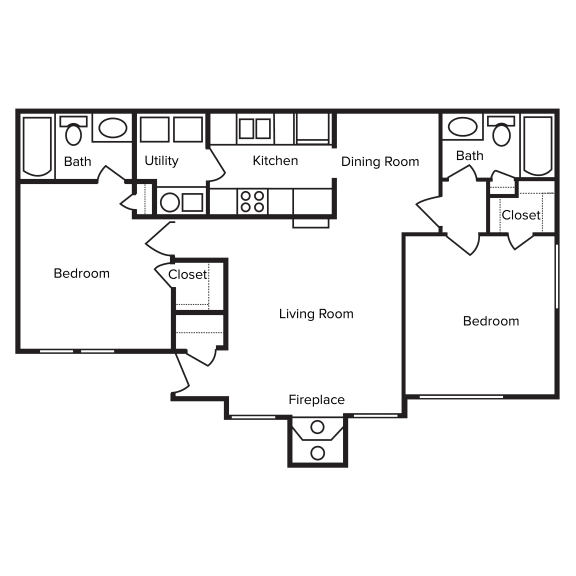
The image size is (576, 576). I want to click on toilet, so [75, 136], [501, 132].